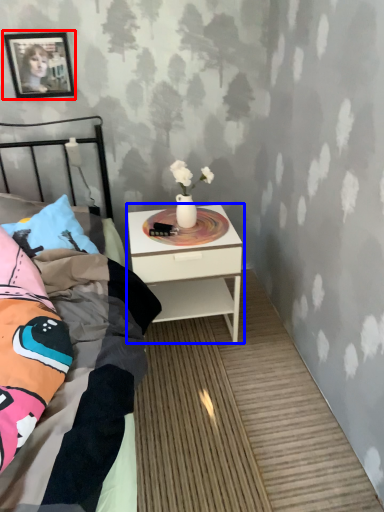
Question: Which of the following is the farthest to the observer, picture frame (highlighted by a red box) or nightstand (highlighted by a blue box)?

Choices:
 (A) picture frame
 (B) nightstand

Answer: (A)